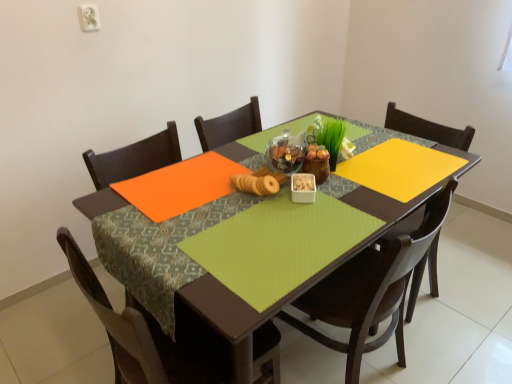
Find the location of a particular element. The image size is (512, 384). vacant space in front of white plastic container at center is located at coordinates (309, 225).